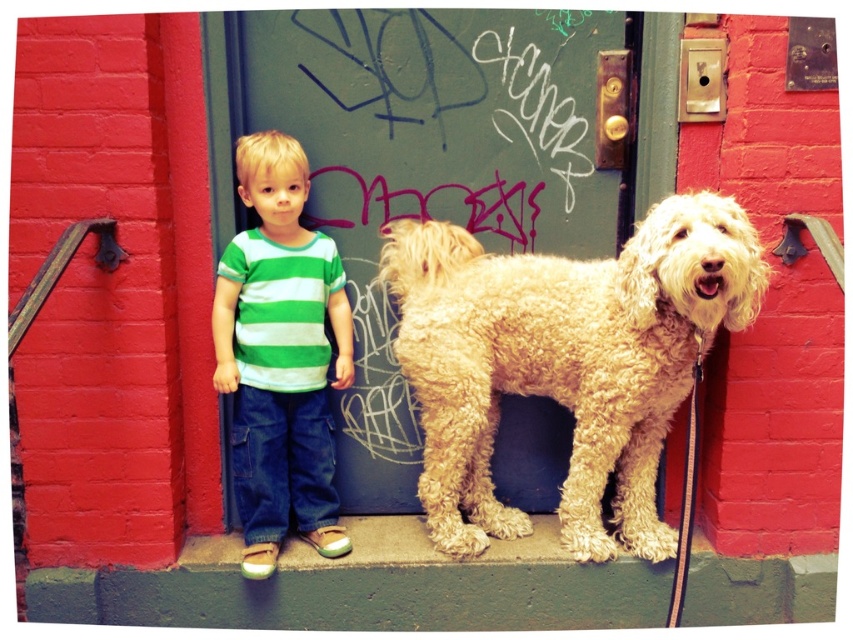
Consider the image. Is green painted wood door at center to the right of green striped shirt at center from the viewer's perspective?

Correct, you'll find green painted wood door at center to the right of green striped shirt at center.

Is point (395, 440) positioned behind point (227, 369)?

Yes.

Does point (440, 134) come in front of point (259, 572)?

No, (440, 134) is behind (259, 572).

At what (x,y) coordinates should I click in order to perform the action: click on green painted wood door at center. Please return your answer as a coordinate pair (x, y). Looking at the image, I should click on (422, 161).

The image size is (853, 640). In order to click on green painted wood door at center in this screenshot , I will do `click(422, 161)`.

Can you confirm if green painted wood door at center is shorter than golden curly fur dog at center?

Incorrect, green painted wood door at center's height does not fall short of golden curly fur dog at center's.

The image size is (853, 640). What do you see at coordinates (422, 161) in the screenshot?
I see `green painted wood door at center` at bounding box center [422, 161].

The height and width of the screenshot is (640, 853). In order to click on green painted wood door at center in this screenshot , I will do (x=422, y=161).

Which is below, golden curly fur dog at center or green striped shirt at center?

golden curly fur dog at center is lower down.

Is the position of golden curly fur dog at center more distant than that of green striped shirt at center?

No, golden curly fur dog at center is closer to the viewer.

Does point (619, 356) come closer to viewer compared to point (245, 529)?

Yes, point (619, 356) is in front of point (245, 529).

Identify the location of golden curly fur dog at center. This screenshot has height=640, width=853. (564, 360).